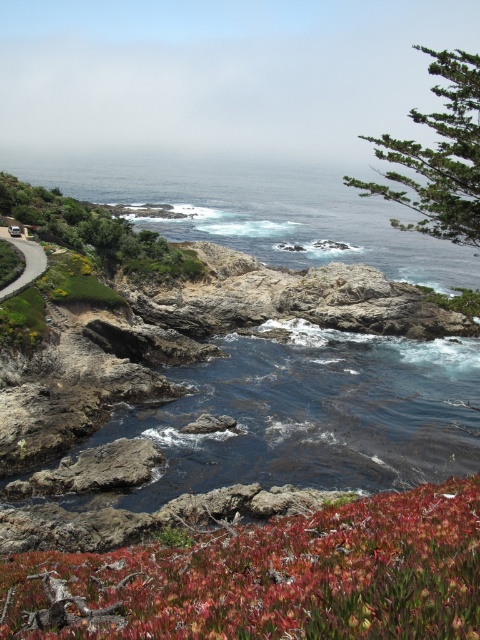
Question: Among these objects, which one is farthest from the camera?

Choices:
 (A) blue water at center
 (B) matte asphalt road at left
 (C) green matte plant at center
 (D) green leafy shrubs at upper left

Answer: (A)

Question: Is green matte plant at center positioned in front of matte asphalt road at left?

Choices:
 (A) yes
 (B) no

Answer: (A)

Question: Which point is closer to the camera taking this photo?

Choices:
 (A) (450, 200)
 (B) (36, 214)
 (C) (133, 560)
 (D) (243, 196)

Answer: (C)

Question: Does green leafy tree at upper right have a greater width compared to matte asphalt road at left?

Choices:
 (A) yes
 (B) no

Answer: (A)

Question: Does green matte plant at center appear under green leafy shrubs at upper left?

Choices:
 (A) yes
 (B) no

Answer: (A)

Question: Among these points, which one is farthest from the camera?

Choices:
 (A) (57, 163)
 (B) (168, 278)
 (C) (384, 138)
 (D) (360, 552)

Answer: (C)